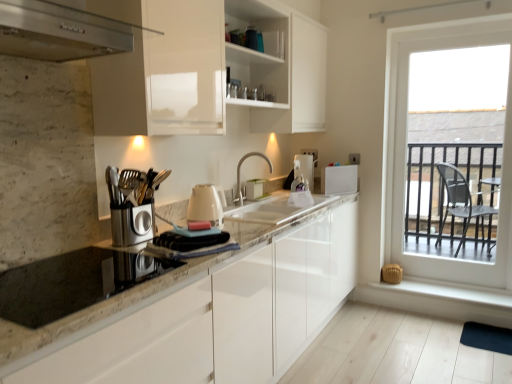
Where is `empty space that is ontop of clear glass window at right (from a real-world perspective)`? This screenshot has height=384, width=512. empty space that is ontop of clear glass window at right (from a real-world perspective) is located at coordinates (460, 33).